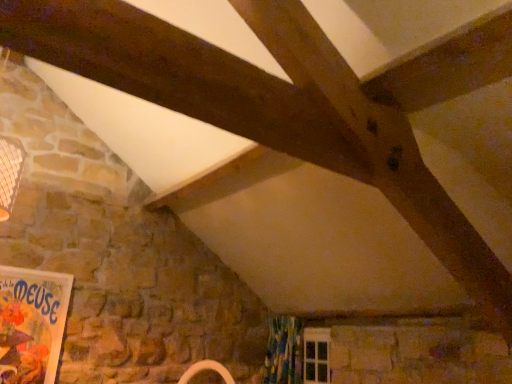
Question: In terms of width, does matte paper poster at lower left look wider or thinner when compared to textured floral curtain at lower center?

Choices:
 (A) thin
 (B) wide

Answer: (A)

Question: From the image's perspective, relative to textured floral curtain at lower center, is matte paper poster at lower left above or below?

Choices:
 (A) below
 (B) above

Answer: (B)

Question: Is matte paper poster at lower left bigger or smaller than textured floral curtain at lower center?

Choices:
 (A) big
 (B) small

Answer: (B)

Question: Is point (287, 374) closer or farther from the camera than point (19, 319)?

Choices:
 (A) farther
 (B) closer

Answer: (A)

Question: Is textured floral curtain at lower center taller or shorter than matte paper poster at lower left?

Choices:
 (A) short
 (B) tall

Answer: (A)

Question: Looking at the image, does textured floral curtain at lower center seem bigger or smaller compared to matte paper poster at lower left?

Choices:
 (A) small
 (B) big

Answer: (B)

Question: From the image's perspective, is textured floral curtain at lower center positioned above or below matte paper poster at lower left?

Choices:
 (A) below
 (B) above

Answer: (A)